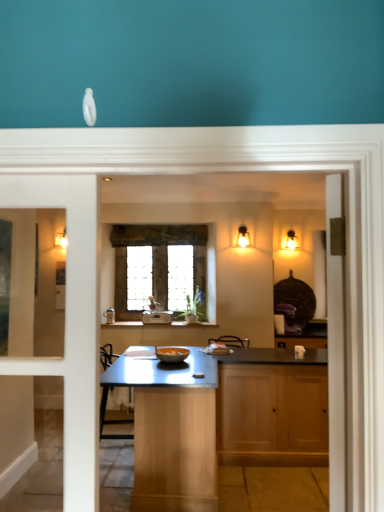
Question: Considering the positions of matte gold sconce at upper right, positioned as the 1th light fixture in right-to-left order, and matte glass sconce at upper center, the second light fixture viewed from the right, in the image, is matte gold sconce at upper right, positioned as the 1th light fixture in right-to-left order, taller or shorter than matte glass sconce at upper center, the second light fixture viewed from the right,?

Choices:
 (A) short
 (B) tall

Answer: (B)

Question: From a real-world perspective, is matte gold sconce at upper right, positioned as the 1th light fixture in right-to-left order, positioned above or below matte glass sconce at upper center, which is the 1th light fixture in front-to-back order?

Choices:
 (A) above
 (B) below

Answer: (A)

Question: Estimate the real-world distances between objects in this image. Which object is closer to the matte glass sconce at upper center, the second light fixture viewed from the right?

Choices:
 (A) matte gold sconce at upper right, placed as the 2th light fixture when sorted from left to right
 (B) wooden cabinet at center
 (C) teal matte wall at upper center
 (D) stained glass window at center

Answer: (D)

Question: Based on their relative distances, which object is farther from the matte glass sconce at upper center, which is counted as the 1th light fixture, starting from the left?

Choices:
 (A) matte gold sconce at upper right, placed as the second light fixture when sorted from front to back
 (B) stained glass window at center
 (C) teal matte wall at upper center
 (D) wooden cabinet at center

Answer: (C)